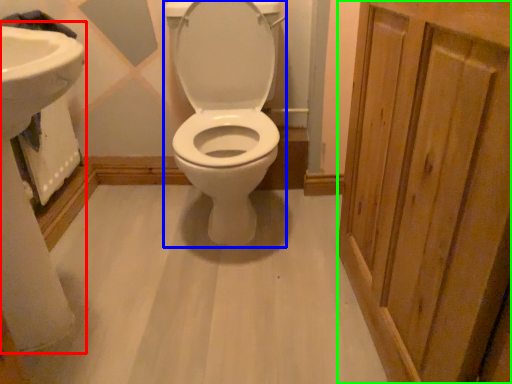
Question: Estimate the real-world distances between objects in this image. Which object is farther from sink (highlighted by a red box), toilet (highlighted by a blue box) or screen door (highlighted by a green box)?

Choices:
 (A) toilet
 (B) screen door

Answer: (B)